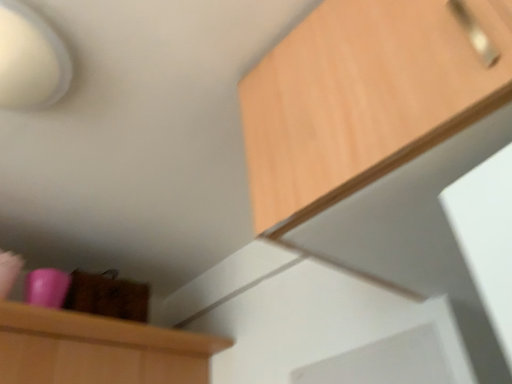
The width and height of the screenshot is (512, 384). Describe the element at coordinates (362, 99) in the screenshot. I see `wooden cabinet at upper right` at that location.

What is the approximate width of wooden cabinet at upper right?

The width of wooden cabinet at upper right is 24.75 inches.

The image size is (512, 384). Identify the location of wooden cabinet at upper right. (362, 99).

Measure the distance between wooden cabinet at upper right and camera.

wooden cabinet at upper right is 20.37 inches from camera.

What do you see at coordinates (30, 59) in the screenshot? I see `white matte lampshade at upper left` at bounding box center [30, 59].

You are a GUI agent. You are given a task and a screenshot of the screen. Output one action in this format:
    pyautogui.click(x=<x>, y=<y>)
    Task: Click on the white matte lampshade at upper left
    
    Given the screenshot: What is the action you would take?
    pyautogui.click(x=30, y=59)

Locate an element on the screen. Image resolution: width=512 pixels, height=384 pixels. wooden cabinet at upper right is located at coordinates (362, 99).

Is wooden cabinet at upper right to the right of white matte lampshade at upper left from the viewer's perspective?

Yes, wooden cabinet at upper right is to the right of white matte lampshade at upper left.

Is wooden cabinet at upper right in front of or behind white matte lampshade at upper left in the image?

Visually, wooden cabinet at upper right is located in front of white matte lampshade at upper left.

Which is behind, point (442, 122) or point (19, 60)?

The point (19, 60) is behind.

From the image's perspective, is wooden cabinet at upper right above or below white matte lampshade at upper left?

wooden cabinet at upper right is below white matte lampshade at upper left.

From a real-world perspective, which is physically above, wooden cabinet at upper right or white matte lampshade at upper left?

In real-world perspective, white matte lampshade at upper left is above.

Can you confirm if wooden cabinet at upper right is wider than white matte lampshade at upper left?

Indeed, wooden cabinet at upper right has a greater width compared to white matte lampshade at upper left.

In terms of height, does wooden cabinet at upper right look taller or shorter compared to white matte lampshade at upper left?

Considering their sizes, wooden cabinet at upper right has more height than white matte lampshade at upper left.

Considering the sizes of objects wooden cabinet at upper right and white matte lampshade at upper left in the image provided, who is bigger, wooden cabinet at upper right or white matte lampshade at upper left?

wooden cabinet at upper right.

Can white matte lampshade at upper left be found inside wooden cabinet at upper right?

No, white matte lampshade at upper left is located outside of wooden cabinet at upper right.

Is wooden cabinet at upper right placed right next to white matte lampshade at upper left?

→ There is a gap between wooden cabinet at upper right and white matte lampshade at upper left.

Is white matte lampshade at upper left at the back of wooden cabinet at upper right?

No, wooden cabinet at upper right is not facing away from white matte lampshade at upper left.

Identify the location of cabinetry that appears below the white matte lampshade at upper left (from the image's perspective). The image size is (512, 384). (362, 99).

Considering the relative positions of white matte lampshade at upper left and wooden cabinet at upper right in the image provided, is white matte lampshade at upper left to the left of wooden cabinet at upper right from the viewer's perspective?

Correct, you'll find white matte lampshade at upper left to the left of wooden cabinet at upper right.

Which object is further away from the camera, white matte lampshade at upper left or wooden cabinet at upper right?

white matte lampshade at upper left is behind.

Which is closer to the camera, (36, 91) or (418, 100)?

Point (36, 91) is positioned farther from the camera compared to point (418, 100).

From the image's perspective, is white matte lampshade at upper left on wooden cabinet at upper right?

Yes, from the image's perspective, white matte lampshade at upper left is over wooden cabinet at upper right.

From the picture: From a real-world perspective, is white matte lampshade at upper left positioned above or below wooden cabinet at upper right?

Clearly, from a real-world perspective, white matte lampshade at upper left is above wooden cabinet at upper right.

Is white matte lampshade at upper left thinner than wooden cabinet at upper right?

Indeed, white matte lampshade at upper left has a lesser width compared to wooden cabinet at upper right.

Which of these two, white matte lampshade at upper left or wooden cabinet at upper right, stands shorter?

white matte lampshade at upper left.

Considering the relative sizes of white matte lampshade at upper left and wooden cabinet at upper right in the image provided, is white matte lampshade at upper left smaller than wooden cabinet at upper right?

Correct, white matte lampshade at upper left occupies less space than wooden cabinet at upper right.

Is white matte lampshade at upper left located outside wooden cabinet at upper right?

Absolutely, white matte lampshade at upper left is external to wooden cabinet at upper right.

From the picture: Would you consider white matte lampshade at upper left to be distant from wooden cabinet at upper right?

No, white matte lampshade at upper left is in close proximity to wooden cabinet at upper right.

Could you tell me if white matte lampshade at upper left is turned towards wooden cabinet at upper right?

No, white matte lampshade at upper left does not turn towards wooden cabinet at upper right.

Based on the photo, what's the angular difference between white matte lampshade at upper left and wooden cabinet at upper right's facing directions?

They differ by 2.51 degrees in their facing directions.

Measure the distance between white matte lampshade at upper left and wooden cabinet at upper right.

white matte lampshade at upper left and wooden cabinet at upper right are 21.96 inches apart from each other.

Identify the location of cabinetry below the white matte lampshade at upper left (from the image's perspective). (362, 99).

Locate an element on the screen. The height and width of the screenshot is (384, 512). cabinetry that appears below the white matte lampshade at upper left (from the image's perspective) is located at coordinates (362, 99).

You are a GUI agent. You are given a task and a screenshot of the screen. Output one action in this format:
    pyautogui.click(x=<x>, y=<y>)
    Task: Click on the lamp above the wooden cabinet at upper right (from a real-world perspective)
    The height and width of the screenshot is (384, 512).
    Given the screenshot: What is the action you would take?
    pyautogui.click(x=30, y=59)